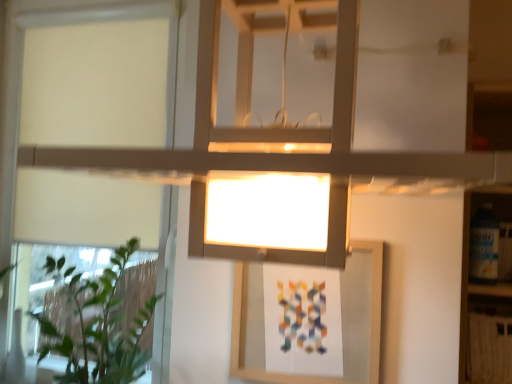
Question: From a real-world perspective, is white matte window at upper left below green leafy plant at left?

Choices:
 (A) yes
 (B) no

Answer: (B)

Question: Is white matte window at upper left far away from green leafy plant at left?

Choices:
 (A) yes
 (B) no

Answer: (B)

Question: From a real-world perspective, is white matte window at upper left located higher than green leafy plant at left?

Choices:
 (A) yes
 (B) no

Answer: (A)

Question: Is white matte window at upper left oriented towards green leafy plant at left?

Choices:
 (A) no
 (B) yes

Answer: (B)

Question: Does white matte window at upper left have a lesser width compared to green leafy plant at left?

Choices:
 (A) no
 (B) yes

Answer: (B)

Question: Considering the relative sizes of white matte window at upper left and green leafy plant at left in the image provided, is white matte window at upper left smaller than green leafy plant at left?

Choices:
 (A) no
 (B) yes

Answer: (B)

Question: Is the surface of green leafy plant at left in direct contact with white matte window at upper left?

Choices:
 (A) no
 (B) yes

Answer: (A)

Question: Is green leafy plant at left oriented towards white matte window at upper left?

Choices:
 (A) yes
 (B) no

Answer: (B)

Question: Does green leafy plant at left have a lesser width compared to white matte window at upper left?

Choices:
 (A) no
 (B) yes

Answer: (A)

Question: Does green leafy plant at left have a lesser height compared to white matte window at upper left?

Choices:
 (A) no
 (B) yes

Answer: (B)

Question: From the image's perspective, would you say green leafy plant at left is positioned over white matte window at upper left?

Choices:
 (A) yes
 (B) no

Answer: (B)

Question: Does green leafy plant at left have a greater width compared to white matte window at upper left?

Choices:
 (A) yes
 (B) no

Answer: (A)

Question: Based on their sizes in the image, would you say green leafy plant at left is bigger or smaller than white matte window at upper left?

Choices:
 (A) big
 (B) small

Answer: (A)